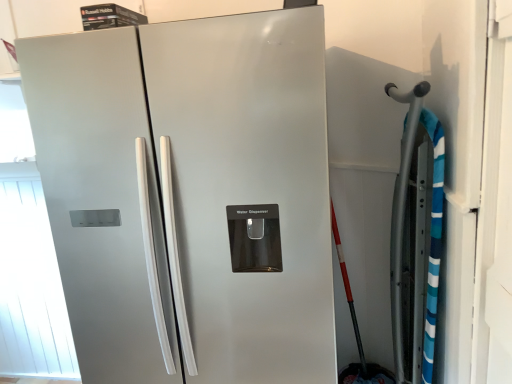
Find the location of a particular element. satin silver refrigerator at left is located at coordinates (99, 197).

What is the approximate width of satin silver refrigerator at left?

It is 29.13 inches.

The image size is (512, 384). What do you see at coordinates (99, 197) in the screenshot?
I see `satin silver refrigerator at left` at bounding box center [99, 197].

Where is `satin silver refrigerator at left`? This screenshot has width=512, height=384. satin silver refrigerator at left is located at coordinates (99, 197).